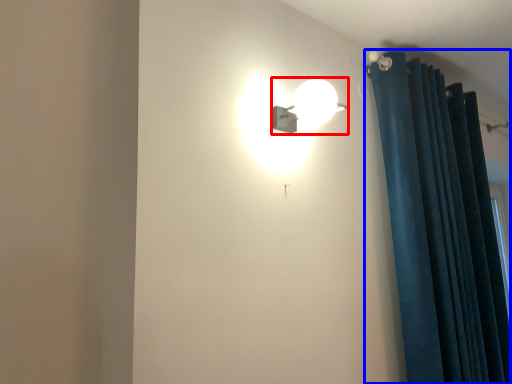
Question: Which object is closer to the camera taking this photo, lamp (highlighted by a red box) or curtain (highlighted by a blue box)?

Choices:
 (A) lamp
 (B) curtain

Answer: (A)